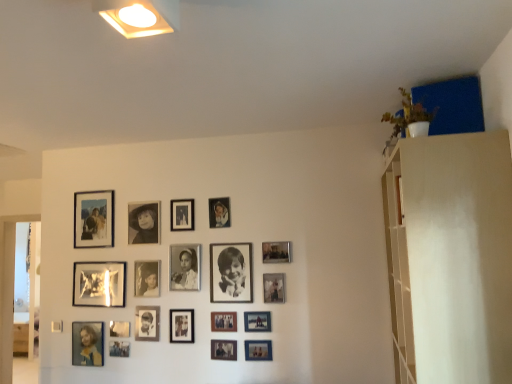
Question: Does metallic silver picture frame at center, acting as the 4th picture frame starting from the left, touch metallic reflective photo frame at upper left, placed as the seventeenth picture frame when sorted from right to left?

Choices:
 (A) no
 (B) yes

Answer: (A)

Question: Is metallic silver picture frame at center, acting as the 4th picture frame starting from the left, positioned behind metallic reflective photo frame at upper left, placed as the 3th picture frame when sorted from left to right?

Choices:
 (A) yes
 (B) no

Answer: (B)

Question: Considering the relative positions of metallic silver picture frame at center, acting as the 4th picture frame starting from the left, and metallic reflective photo frame at upper left, placed as the 3th picture frame when sorted from left to right, in the image provided, is metallic silver picture frame at center, acting as the 4th picture frame starting from the left, to the right of metallic reflective photo frame at upper left, placed as the 3th picture frame when sorted from left to right, from the viewer's perspective?

Choices:
 (A) yes
 (B) no

Answer: (A)

Question: Is metallic silver picture frame at center, the 16th picture frame positioned from the right, surrounding metallic reflective photo frame at upper left, placed as the seventeenth picture frame when sorted from right to left?

Choices:
 (A) no
 (B) yes

Answer: (A)

Question: From the image's perspective, is metallic silver picture frame at center, the 16th picture frame positioned from the right, over metallic reflective photo frame at upper left, placed as the seventeenth picture frame when sorted from right to left?

Choices:
 (A) yes
 (B) no

Answer: (B)

Question: Is metallic silver picture frame at center, acting as the 4th picture frame starting from the left, not inside metallic reflective photo frame at upper left, placed as the seventeenth picture frame when sorted from right to left?

Choices:
 (A) no
 (B) yes

Answer: (B)

Question: From a real-world perspective, is black matte picture frame at center, acting as the fifteenth picture frame starting from the left, below black matte photo frame at center, marked as the eighth picture frame in a left-to-right arrangement?

Choices:
 (A) yes
 (B) no

Answer: (B)

Question: Could you tell me if black matte picture frame at center, which is the 5th picture frame in right-to-left order, is facing black matte photo frame at center, marked as the eighth picture frame in a left-to-right arrangement?

Choices:
 (A) yes
 (B) no

Answer: (B)

Question: Is black matte picture frame at center, acting as the fifteenth picture frame starting from the left, in front of black matte photo frame at center, marked as the eighth picture frame in a left-to-right arrangement?

Choices:
 (A) no
 (B) yes

Answer: (B)

Question: Is black matte picture frame at center, acting as the fifteenth picture frame starting from the left, completely or partially outside of black matte photo frame at center, marked as the eighth picture frame in a left-to-right arrangement?

Choices:
 (A) yes
 (B) no

Answer: (A)

Question: Considering the relative sizes of black matte picture frame at center, acting as the fifteenth picture frame starting from the left, and black matte photo frame at center, the twelfth picture frame from the right, in the image provided, is black matte picture frame at center, acting as the fifteenth picture frame starting from the left, wider than black matte photo frame at center, the twelfth picture frame from the right,?

Choices:
 (A) no
 (B) yes

Answer: (B)

Question: Does black matte picture frame at center, acting as the fifteenth picture frame starting from the left, come behind black matte photo frame at center, marked as the eighth picture frame in a left-to-right arrangement?

Choices:
 (A) no
 (B) yes

Answer: (A)

Question: Is black matte photo frame at center, acting as the ninth picture frame starting from the right, turned away from black matte photo frame at upper center, acting as the fourteenth picture frame starting from the right?

Choices:
 (A) yes
 (B) no

Answer: (B)